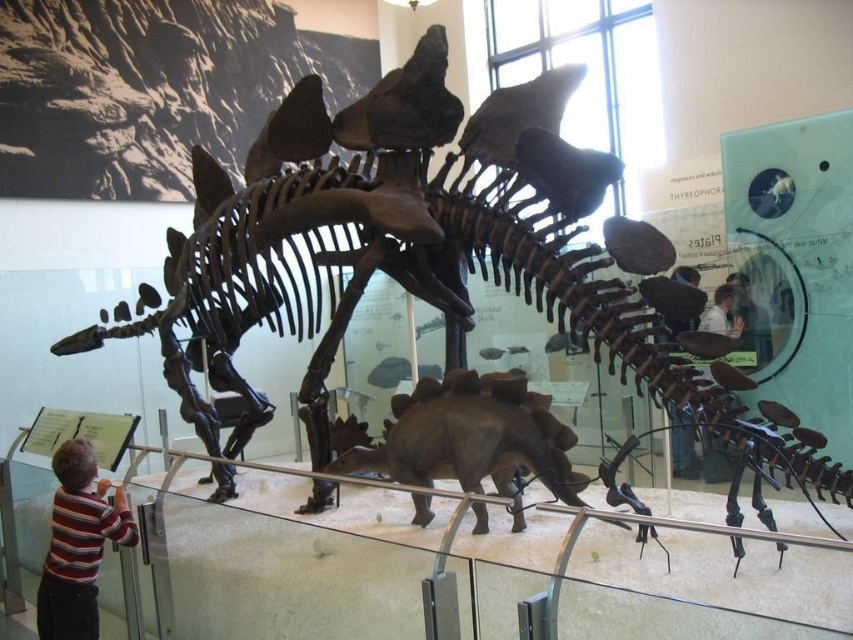
Question: Does brown matte stegosaurus at center appear over striped shirt at lower left?

Choices:
 (A) yes
 (B) no

Answer: (A)

Question: Can you confirm if brown matte stegosaurus at center is smaller than striped shirt at lower left?

Choices:
 (A) no
 (B) yes

Answer: (A)

Question: Is brown matte stegosaurus at center thinner than striped shirt at lower left?

Choices:
 (A) yes
 (B) no

Answer: (B)

Question: Which point appears farthest from the camera in this image?

Choices:
 (A) (74, 541)
 (B) (386, 445)

Answer: (B)

Question: Which point is closer to the camera?

Choices:
 (A) striped shirt at lower left
 (B) brown matte stegosaurus at center

Answer: (B)